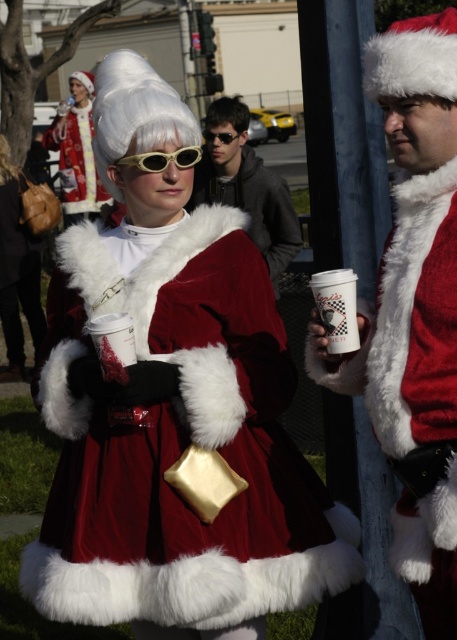
The width and height of the screenshot is (457, 640). What do you see at coordinates (414, 310) in the screenshot? I see `velvet santa coat at center` at bounding box center [414, 310].

Is point (398, 204) positioned before point (352, 307)?

No.

Locate an element on the screen. velvet santa coat at center is located at coordinates (414, 310).

Does white paper cup at center have a greater height compared to white fuzzy wig at center?

Yes, white paper cup at center is taller than white fuzzy wig at center.

Which is above, white paper cup at center or white fuzzy wig at center?

Positioned higher is white fuzzy wig at center.

Is point (328, 275) farther from camera compared to point (139, 125)?

No, it is not.

The image size is (457, 640). Identify the location of white paper cup at center. (336, 308).

Who is more distant from viewer, [357,316] or [10,173]?

Positioned behind is point [10,173].

Locate an element on the screen. velvet santa coat at center is located at coordinates (414, 310).